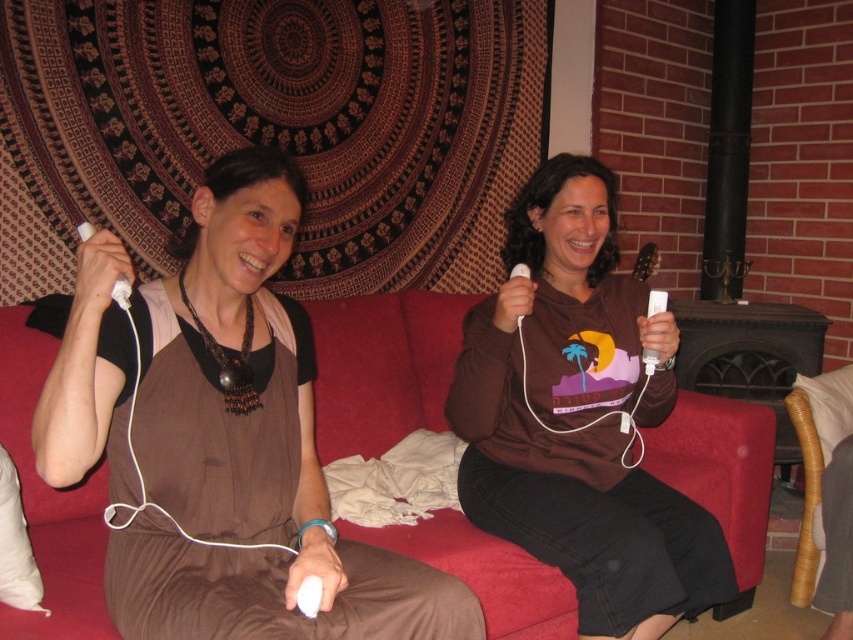
Question: Is white matte remote at lower center to the right of white plastic remote at center from the viewer's perspective?

Choices:
 (A) no
 (B) yes

Answer: (A)

Question: Estimate the real-world distances between objects in this image. Which object is farther from the white plastic remote at upper center?

Choices:
 (A) white matte remote at lower center
 (B) white plastic remote at center
 (C) brown matte shirt at center
 (D) brown fabric dress at center

Answer: (A)

Question: Which of the following is the farthest from the observer?

Choices:
 (A) (82, 230)
 (B) (589, 195)

Answer: (B)

Question: Can you confirm if brown fabric dress at center is positioned below brown matte shirt at center?

Choices:
 (A) no
 (B) yes

Answer: (A)

Question: Does white plastic remote at center come in front of white plastic remote at upper center?

Choices:
 (A) yes
 (B) no

Answer: (A)

Question: Among these points, which one is nearest to the camera?

Choices:
 (A) coord(119,282)
 (B) coord(646,531)

Answer: (A)